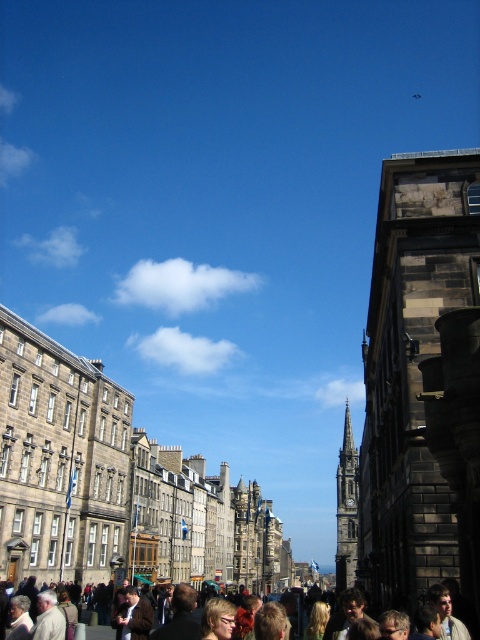
You are an architect analyzing the spatial relationships in this Victorian street scene. Based on the image, which of the two structures, the dark stone tower at right or the dark gray stone spire at center, is positioned higher in the visual field?

The dark stone tower at right is positioned higher in the visual field than the dark gray stone spire at center.

You are standing in the middle of the bustling Victorian street scene. You notice two points marked on the ground at coordinates point (360, 508) and point (352, 490). Which point is closer to your current position?

Point (360, 508) is closer to the camera than point (352, 490), so it is closer to your current position.

You are a tourist standing on the street and want to take a photo of the dark gray stone spire at center. However, there is a person wearing a brown leather jacket at lower center blocking your view. Can you see the spire through the space between them?

The dark gray stone spire at center is located below the brown leather jacket at lower center, so the person wearing the brown leather jacket at lower center is blocking the view of the spire. You cannot see the spire through the space between them.